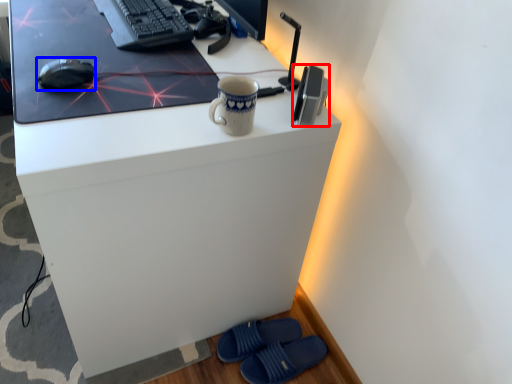
Question: Which point is further to the camera, gadget (highlighted by a red box) or mouse (highlighted by a blue box)?

Choices:
 (A) gadget
 (B) mouse

Answer: (B)